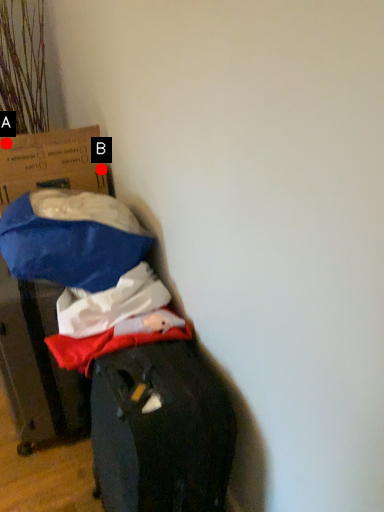
Question: Two points are circled on the image, labeled by A and B beside each circle. Which point appears farthest from the camera in this image?

Choices:
 (A) A is further
 (B) B is further

Answer: (B)